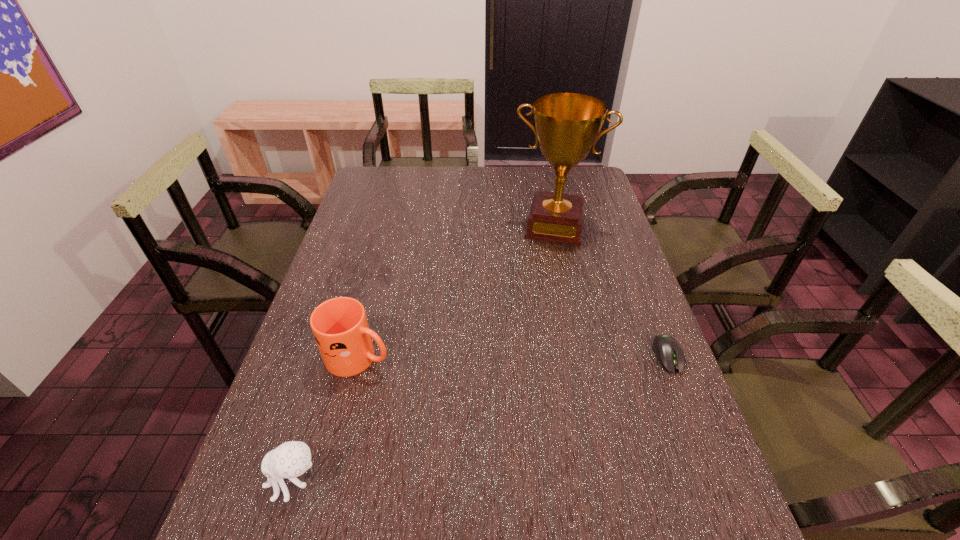
Find the location of a particular element. This screenshot has height=540, width=960. free space at the far edge of the desktop is located at coordinates (508, 176).

This screenshot has height=540, width=960. Identify the location of vacant space at the near edge of the desktop. (441, 505).

Where is `free spot at the left edge of the desktop`? This screenshot has height=540, width=960. free spot at the left edge of the desktop is located at coordinates (358, 294).

Locate an element on the screen. vacant area at the right edge is located at coordinates (610, 381).

What are the coordinates of `vacant space at the far left corner` in the screenshot? It's located at (372, 187).

This screenshot has height=540, width=960. Identify the location of vacant space in between the nearest object and the second object from right to left. (424, 353).

At what (x,y) coordinates should I click in order to perform the action: click on free space between the octopus and the farthest object. Please return your answer as a coordinate pair (x, y). Looking at the image, I should click on (424, 353).

At what (x,y) coordinates should I click in order to perform the action: click on free space that is in between the rightmost object and the mug. Please return your answer as a coordinate pair (x, y). This screenshot has height=540, width=960. Looking at the image, I should click on (514, 356).

Where is `free space that is in between the third object from left to right and the second tallest object`? Image resolution: width=960 pixels, height=540 pixels. free space that is in between the third object from left to right and the second tallest object is located at coordinates (457, 291).

Find the location of a particular element. This screenshot has height=540, width=960. free space between the mug and the farthest object is located at coordinates (457, 291).